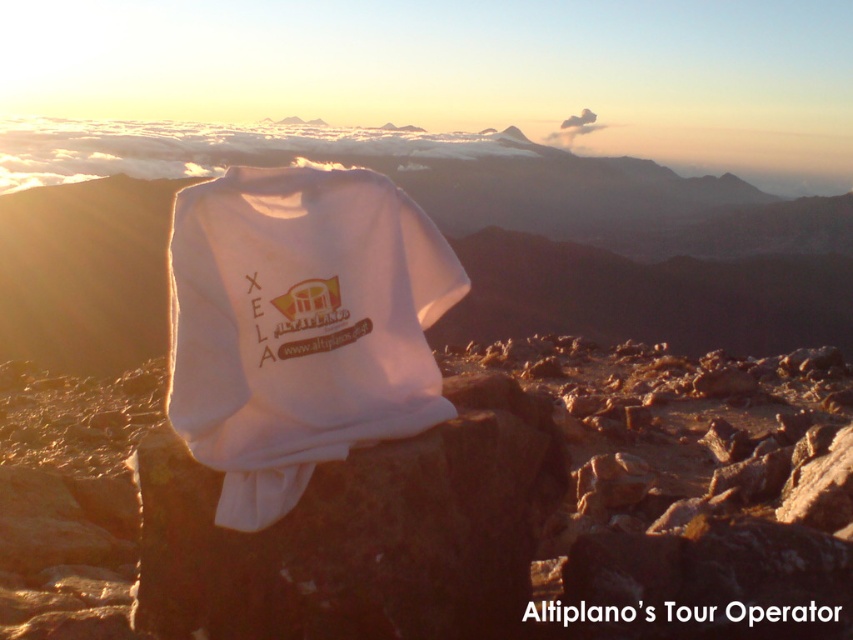
Question: Is white cotton t-shirt at center bigger than white fabric at center?

Choices:
 (A) yes
 (B) no

Answer: (B)

Question: Does white fabric t-shirt at center appear over white cotton t-shirt at center?

Choices:
 (A) no
 (B) yes

Answer: (B)

Question: Which of the following is the closest to the observer?

Choices:
 (A) white fabric t-shirt at center
 (B) white cotton t-shirt at center

Answer: (B)

Question: Estimate the real-world distances between objects in this image. Which object is farther from the white cotton t-shirt at center?

Choices:
 (A) white fabric t-shirt at center
 (B) white fabric at center

Answer: (A)

Question: Is white fabric t-shirt at center smaller than white cotton t-shirt at center?

Choices:
 (A) yes
 (B) no

Answer: (B)

Question: Considering the real-world distances, which object is farthest from the white cotton t-shirt at center?

Choices:
 (A) white fabric at center
 (B) white fabric t-shirt at center

Answer: (B)